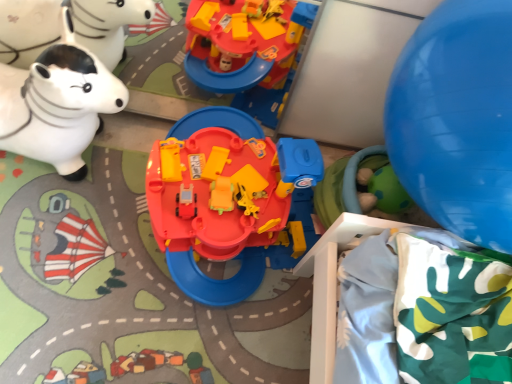
Question: Is white glossy rocking horse at left, arranged as the third toy when viewed from the right, oriented towards blue rubber balloon at right?

Choices:
 (A) yes
 (B) no

Answer: (A)

Question: Does white glossy rocking horse at left, acting as the 1th toy starting from the left, contain blue rubber balloon at right?

Choices:
 (A) no
 (B) yes

Answer: (A)

Question: Can you confirm if white glossy rocking horse at left, acting as the 1th toy starting from the left, is bigger than blue rubber balloon at right?

Choices:
 (A) no
 (B) yes

Answer: (A)

Question: Can you confirm if white glossy rocking horse at left, acting as the 1th toy starting from the left, is shorter than blue rubber balloon at right?

Choices:
 (A) yes
 (B) no

Answer: (A)

Question: Does white glossy rocking horse at left, arranged as the third toy when viewed from the right, appear on the left side of blue rubber balloon at right?

Choices:
 (A) no
 (B) yes

Answer: (B)

Question: From the image's perspective, is matte plastic playset at center, positioned as the second toy in right-to-left order, located above or below green rubber ball at lower right, which is the first toy from right to left?

Choices:
 (A) below
 (B) above

Answer: (A)

Question: Is matte plastic playset at center, which ranks as the 2th toy in left-to-right order, inside the boundaries of green rubber ball at lower right, which is the first toy from right to left, or outside?

Choices:
 (A) inside
 (B) outside

Answer: (B)

Question: Is point (203, 203) closer or farther from the camera than point (386, 213)?

Choices:
 (A) farther
 (B) closer

Answer: (B)

Question: In terms of size, does matte plastic playset at center, which ranks as the 2th toy in left-to-right order, appear bigger or smaller than green rubber ball at lower right, which is the first toy from right to left?

Choices:
 (A) big
 (B) small

Answer: (A)

Question: From a real-world perspective, is green rubber ball at lower right, which is the first toy from right to left, physically located above or below blue rubber balloon at right?

Choices:
 (A) above
 (B) below

Answer: (B)

Question: Considering the positions of point (367, 190) and point (477, 157), is point (367, 190) closer or farther from the camera than point (477, 157)?

Choices:
 (A) closer
 (B) farther

Answer: (B)

Question: Is green rubber ball at lower right, positioned as the third toy in left-to-right order, wider or thinner than blue rubber balloon at right?

Choices:
 (A) wide
 (B) thin

Answer: (B)

Question: Which is correct: green rubber ball at lower right, which is the first toy from right to left, is inside blue rubber balloon at right, or outside of it?

Choices:
 (A) inside
 (B) outside

Answer: (B)

Question: Looking at the image, does blue rubber balloon at right seem bigger or smaller compared to matte plastic playset at center, which ranks as the 2th toy in left-to-right order?

Choices:
 (A) big
 (B) small

Answer: (A)

Question: Does point (480, 107) appear closer or farther from the camera than point (296, 200)?

Choices:
 (A) farther
 (B) closer

Answer: (B)